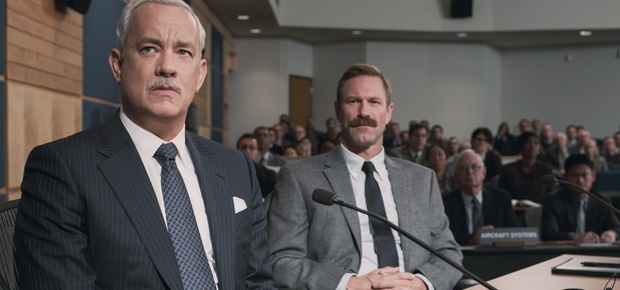
This screenshot has height=290, width=620. In order to click on notepad in this screenshot , I will do [580, 269], [604, 241].